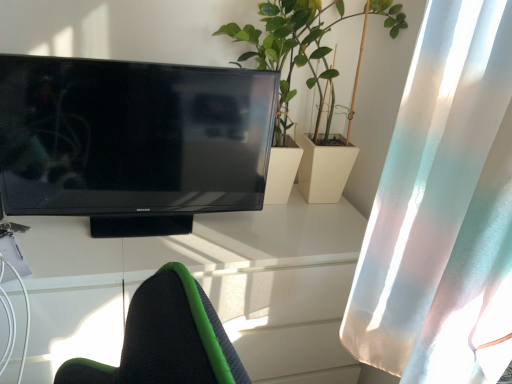
The width and height of the screenshot is (512, 384). Describe the element at coordinates (203, 286) in the screenshot. I see `white glossy desk at center` at that location.

Where is `matte black television at left`? matte black television at left is located at coordinates (132, 141).

Measure the distance from white glossy desk at center to matte black television at left.

white glossy desk at center and matte black television at left are 10.25 inches apart from each other.

From the image's perspective, between white glossy desk at center and matte black television at left, which one is located above?

matte black television at left, from the image's perspective.

Where is `desk that is under the matte black television at left (from a real-world perspective)`? desk that is under the matte black television at left (from a real-world perspective) is located at coordinates (203, 286).

Which is correct: white glossy desk at center is inside matte black television at left, or outside of it?

The correct answer is: outside.

Is green leafy plant at center completely or partially outside of white glossy desk at center?

Yes, green leafy plant at center is outside of white glossy desk at center.

Is the position of green leafy plant at center less distant than that of white glossy desk at center?

No, green leafy plant at center is further to the viewer.

From the image's perspective, is green leafy plant at center above or below white glossy desk at center?

green leafy plant at center is above white glossy desk at center.

Is green leafy plant at center turned away from white glossy desk at center?

No.

Between translucent white curtain at right and green leafy plant at center, which one appears on the left side from the viewer's perspective?

From the viewer's perspective, green leafy plant at center appears more on the left side.

From a real-world perspective, is translucent white curtain at right positioned above or below green leafy plant at center?

translucent white curtain at right is situated lower than green leafy plant at center in the real world.

Looking at their sizes, would you say translucent white curtain at right is wider or thinner than green leafy plant at center?

In the image, translucent white curtain at right appears to be more narrow than green leafy plant at center.

Are translucent white curtain at right and green leafy plant at center making contact?

They are not placed beside each other.

Between matte black television at left and translucent white curtain at right, which one has larger size?

Bigger between the two is translucent white curtain at right.

Is matte black television at left with translucent white curtain at right?

matte black television at left and translucent white curtain at right are not in contact.

Between matte black television at left and translucent white curtain at right, which one appears on the left side from the viewer's perspective?

matte black television at left is more to the left.

From a real-world perspective, between green leafy plant at center and translucent white curtain at right, who is vertically higher?

From a 3D spatial view, green leafy plant at center is above.

From the image's perspective, who appears lower, green leafy plant at center or translucent white curtain at right?

translucent white curtain at right, from the image's perspective.

In terms of size, does green leafy plant at center appear bigger or smaller than translucent white curtain at right?

In the image, green leafy plant at center appears to be larger than translucent white curtain at right.

From the picture: Is translucent white curtain at right shorter than matte black television at left?

No, translucent white curtain at right is not shorter than matte black television at left.

Considering the sizes of objects translucent white curtain at right and matte black television at left in the image provided, who is smaller, translucent white curtain at right or matte black television at left?

matte black television at left is smaller.

Is translucent white curtain at right thinner than matte black television at left?

No.

From the image's perspective, between translucent white curtain at right and matte black television at left, who is located below?

translucent white curtain at right is shown below in the image.

Which is less distant, (x=59, y=104) or (x=245, y=223)?

Point (x=59, y=104) appears to be closer to the viewer than point (x=245, y=223).

Does matte black television at left have a larger size compared to white glossy desk at center?

Incorrect, matte black television at left is not larger than white glossy desk at center.

Is matte black television at left turned away from white glossy desk at center?

That's not correct — matte black television at left is not looking away from white glossy desk at center.

This screenshot has height=384, width=512. What are the coordinates of `television above the white glossy desk at center (from a real-world perspective)` in the screenshot? It's located at (132, 141).

At what (x,y) coordinates should I click in order to perform the action: click on houseplant located on the right of white glossy desk at center. Please return your answer as a coordinate pair (x, y). The image size is (512, 384). Looking at the image, I should click on click(305, 51).

In the scene shown: When comparing their distances from green leafy plant at center, does white glossy desk at center or translucent white curtain at right seem closer?

Among the two, white glossy desk at center is located nearer to green leafy plant at center.

Consider the image. Considering their positions, is matte black television at left positioned closer to green leafy plant at center than white glossy desk at center?

matte black television at left is positioned closer to the anchor green leafy plant at center.

From the image, which object appears to be farther from white glossy desk at center, green leafy plant at center or matte black television at left?

Answer: green leafy plant at center lies further to white glossy desk at center than the other object.

Consider the image. When comparing their distances from translucent white curtain at right, does green leafy plant at center or matte black television at left seem further?

green leafy plant at center lies further to translucent white curtain at right than the other object.

Considering their positions, is translucent white curtain at right positioned further to white glossy desk at center than green leafy plant at center?

green leafy plant at center.

When comparing their distances from matte black television at left, does white glossy desk at center or green leafy plant at center seem closer?

Based on the image, white glossy desk at center appears to be nearer to matte black television at left.

In the scene shown: From the image, which object appears to be nearer to white glossy desk at center, green leafy plant at center or translucent white curtain at right?

translucent white curtain at right.

Based on their spatial positions, is green leafy plant at center or translucent white curtain at right further from matte black television at left?

The object further to matte black television at left is translucent white curtain at right.

This screenshot has width=512, height=384. Identify the location of television that lies between green leafy plant at center and white glossy desk at center from top to bottom. (132, 141).

Where is `television between translucent white curtain at right and green leafy plant at center in the front-back direction`? The image size is (512, 384). television between translucent white curtain at right and green leafy plant at center in the front-back direction is located at coordinates (132, 141).

Identify the location of desk located between matte black television at left and translucent white curtain at right in the left-right direction. (203, 286).

Locate an element on the screen. desk between translucent white curtain at right and green leafy plant at center from front to back is located at coordinates (203, 286).